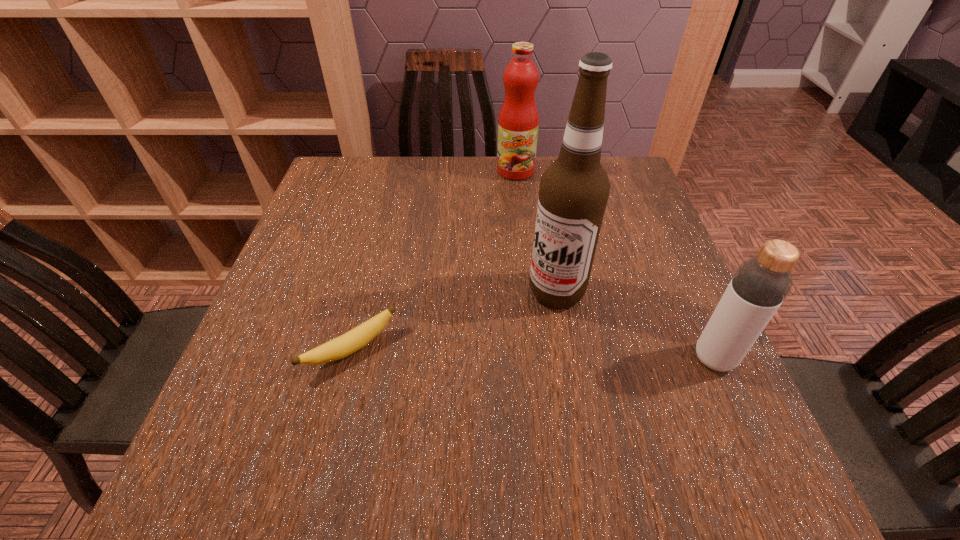
Identify the location of the shortest object. (352, 341).

This screenshot has width=960, height=540. What are the coordinates of `the leftmost object` in the screenshot? It's located at (352, 341).

Locate an element on the screen. This screenshot has width=960, height=540. the third tallest object is located at coordinates (759, 286).

The image size is (960, 540). I want to click on bottle, so click(759, 286).

At what (x,y) coordinates should I click in order to perform the action: click on the second farthest object. Please return your answer as a coordinate pair (x, y). Looking at the image, I should click on (574, 190).

At what (x,y) coordinates should I click in order to perform the action: click on the tallest object. Please return your answer as a coordinate pair (x, y). The height and width of the screenshot is (540, 960). Looking at the image, I should click on (574, 190).

Identify the location of the farthest object. This screenshot has height=540, width=960. (518, 122).

The image size is (960, 540). I want to click on fruit juice, so click(518, 122).

You are a GUI agent. You are given a task and a screenshot of the screen. Output one action in this format:
    pyautogui.click(x=<x>, y=<y>)
    Task: Click on the blank space located on the back of the banana
    
    Given the screenshot: What is the action you would take?
    pyautogui.click(x=376, y=249)

Find the location of a particular element. Image resolution: width=960 pixels, height=540 pixels. vacant area located on the back of the rightmost object is located at coordinates (654, 223).